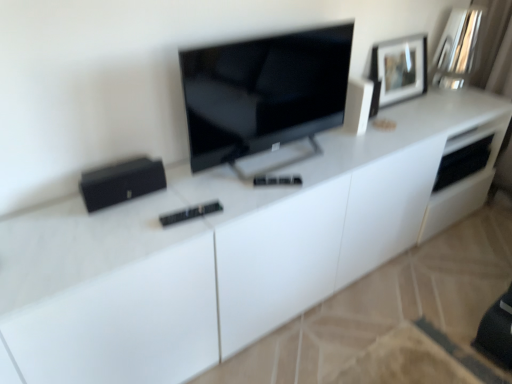
Question: Is black matte speaker at left, positioned as the first appliance in bottom-to-top order, turned away from matte black picture frame at upper right?

Choices:
 (A) yes
 (B) no

Answer: (B)

Question: Is black matte speaker at left, placed as the 1th appliance when sorted from left to right, not close to matte black picture frame at upper right?

Choices:
 (A) yes
 (B) no

Answer: (A)

Question: From a real-world perspective, does black matte speaker at left, the 2th appliance viewed from the top, sit lower than matte black picture frame at upper right?

Choices:
 (A) no
 (B) yes

Answer: (B)

Question: From a real-world perspective, is black matte speaker at left, placed as the first appliance when sorted from front to back, physically above matte black picture frame at upper right?

Choices:
 (A) yes
 (B) no

Answer: (B)

Question: From the image's perspective, is black matte speaker at left, positioned as the second appliance in back-to-front order, under matte black picture frame at upper right?

Choices:
 (A) yes
 (B) no

Answer: (A)

Question: From the image's perspective, is matte black tv at center positioned above or below matte black picture frame at upper right?

Choices:
 (A) below
 (B) above

Answer: (A)

Question: From a real-world perspective, is matte black tv at center physically located above or below matte black picture frame at upper right?

Choices:
 (A) above
 (B) below

Answer: (A)

Question: In the image, is matte black tv at center positioned in front of or behind matte black picture frame at upper right?

Choices:
 (A) behind
 (B) front

Answer: (B)

Question: Considering the relative positions of matte black tv at center and matte black picture frame at upper right in the image provided, is matte black tv at center to the left or to the right of matte black picture frame at upper right?

Choices:
 (A) right
 (B) left

Answer: (B)

Question: From the image's perspective, is black matte speaker at left, placed as the first appliance when sorted from front to back, positioned above or below matte black picture frame at upper right?

Choices:
 (A) below
 (B) above

Answer: (A)

Question: From their relative heights in the image, would you say black matte speaker at left, placed as the 1th appliance when sorted from left to right, is taller or shorter than matte black picture frame at upper right?

Choices:
 (A) tall
 (B) short

Answer: (B)

Question: From a real-world perspective, is black matte speaker at left, placed as the 1th appliance when sorted from left to right, positioned above or below matte black picture frame at upper right?

Choices:
 (A) above
 (B) below

Answer: (B)

Question: Is point (95, 195) positioned closer to the camera than point (425, 39)?

Choices:
 (A) farther
 (B) closer

Answer: (B)

Question: Does point (354, 109) appear closer or farther from the camera than point (92, 193)?

Choices:
 (A) closer
 (B) farther

Answer: (B)

Question: Is white glossy speaker at upper right, the 2th appliance from the left, wider or thinner than black matte speaker at left, placed as the first appliance when sorted from front to back?

Choices:
 (A) wide
 (B) thin

Answer: (A)